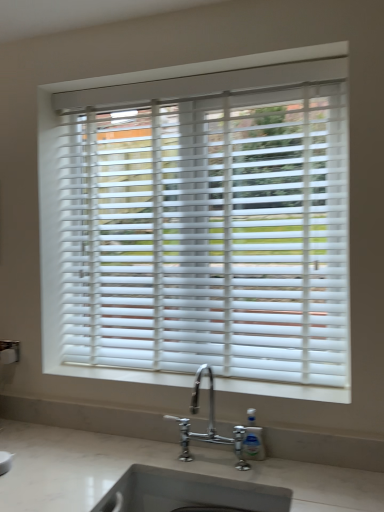
This screenshot has height=512, width=384. I want to click on vacant area that lies between clear plastic soap dispenser at lower center and chrome metallic faucet at lower center, so click(222, 456).